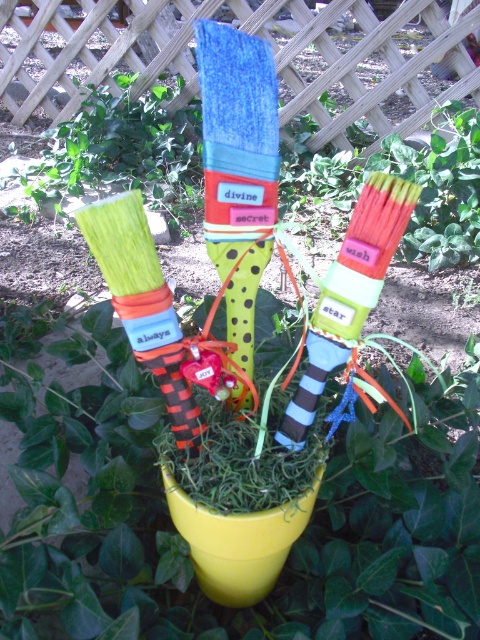
You are an artist trying to hang a new decoration between the matte green paintbrush at center and the green polka dot sock at center. Which object should you place the decoration above to ensure it hangs correctly?

You should place the decoration above the matte green paintbrush at center because it is positioned under the green polka dot sock at center, so placing the decoration above the paintbrush will allow it to hang correctly between them.

You are an artist who wants to hang a small decoration between the matte green paintbrush at center and the green polka dot sock at center. Which object should you attach the decoration to if you want it to be higher?

The matte green paintbrush at center is taller than the green polka dot sock at center, so you should attach the decoration to the matte green paintbrush at center to have it higher.